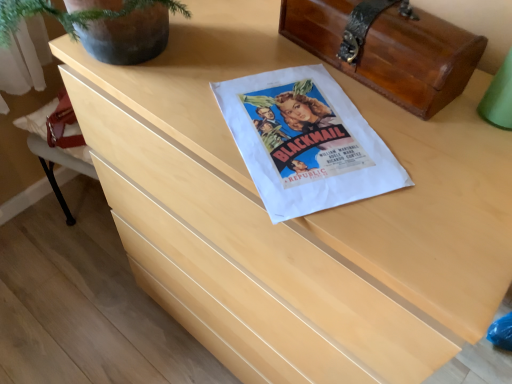
Locate an element on the screen. free location to the left of white paper flyer at center is located at coordinates (183, 99).